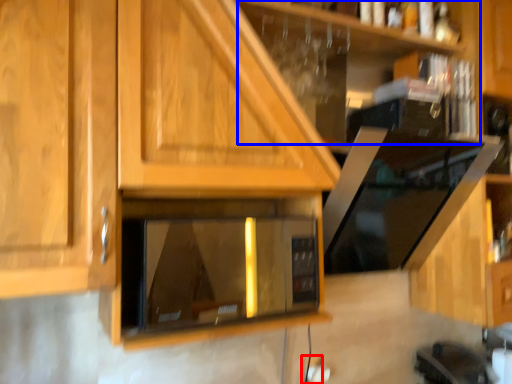
Question: Which of the following is the farthest to the observer, electric outlet (highlighted by a red box) or shelf (highlighted by a blue box)?

Choices:
 (A) electric outlet
 (B) shelf

Answer: (A)